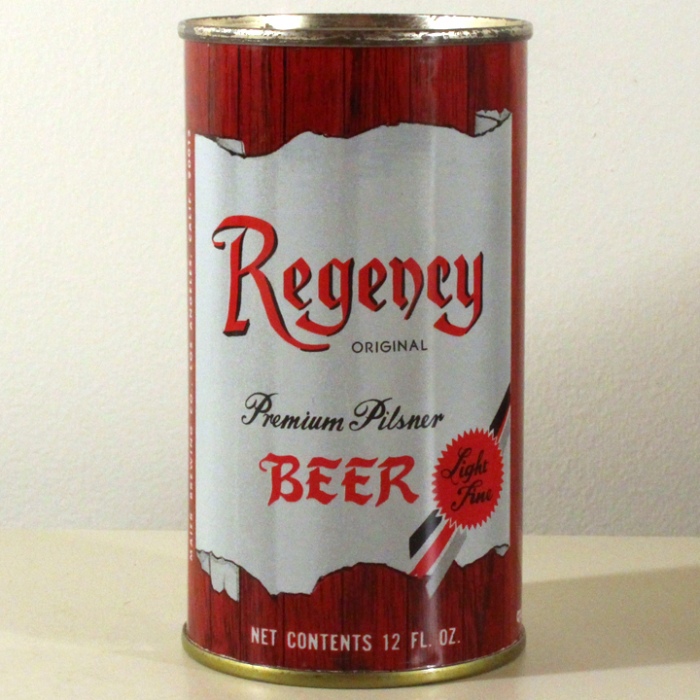
Find the location of `lights`. lights is located at coordinates (477, 465).